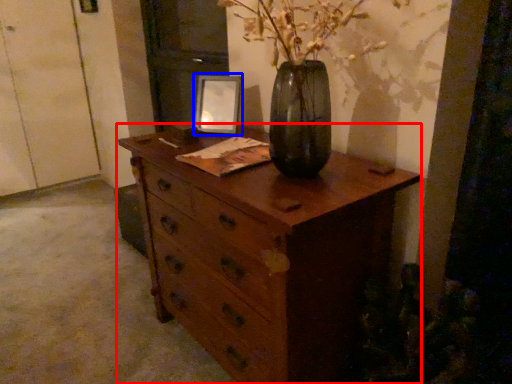
Question: Which object is closer to the camera taking this photo, chest of drawers (highlighted by a red box) or picture frame (highlighted by a blue box)?

Choices:
 (A) chest of drawers
 (B) picture frame

Answer: (A)